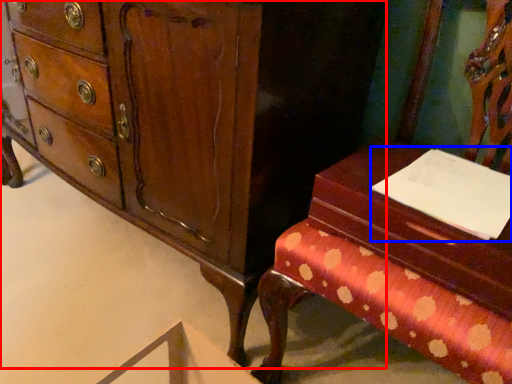
Question: Which object is further to the camera taking this photo, chest of drawers (highlighted by a red box) or notepad (highlighted by a blue box)?

Choices:
 (A) chest of drawers
 (B) notepad

Answer: (B)